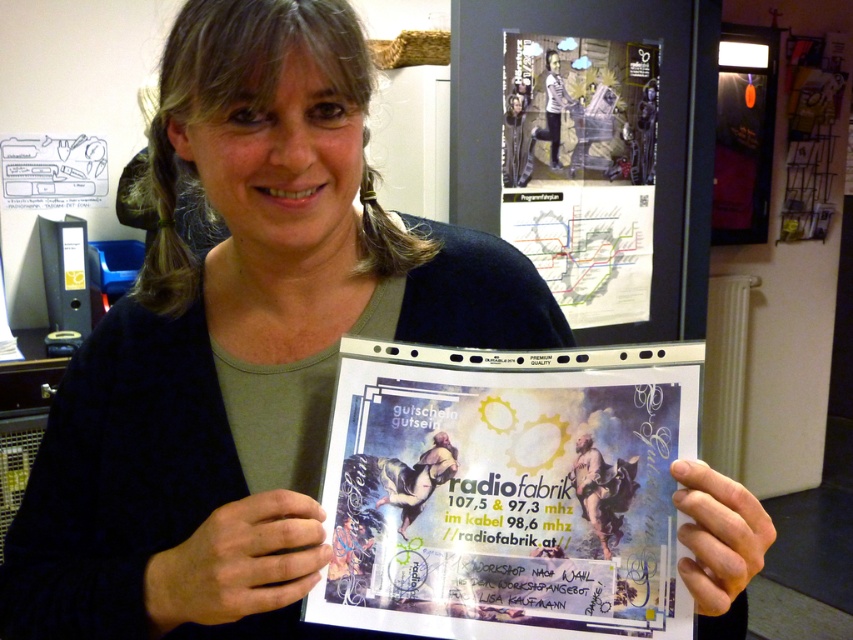
Question: Which point is closer to the camera?

Choices:
 (A) white paper poster at center
 (B) matte paper poster at upper center

Answer: (A)

Question: Can you confirm if white paper poster at center is bigger than matte paper poster at upper center?

Choices:
 (A) yes
 (B) no

Answer: (B)

Question: Does white paper poster at center appear over matte paper poster at upper center?

Choices:
 (A) no
 (B) yes

Answer: (A)

Question: Can you confirm if white paper poster at center is wider than matte paper poster at upper center?

Choices:
 (A) no
 (B) yes

Answer: (A)